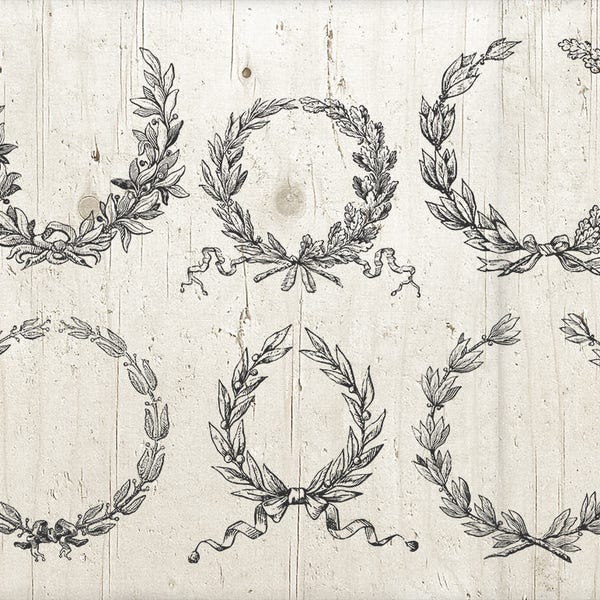
Identify the location of tiny buds on wreath second row last wreath. (491, 345), (441, 489), (431, 405), (448, 368), (592, 344), (466, 507), (500, 521).